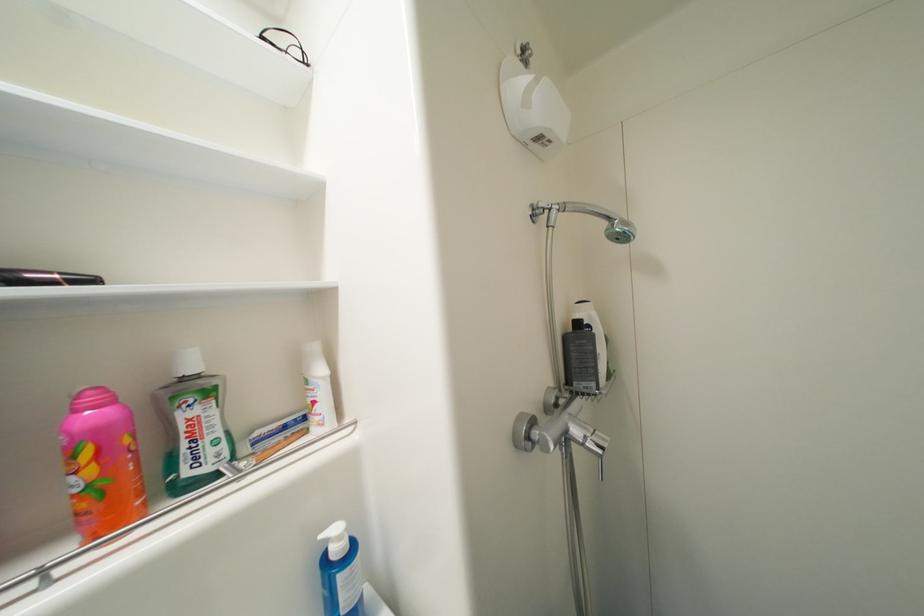
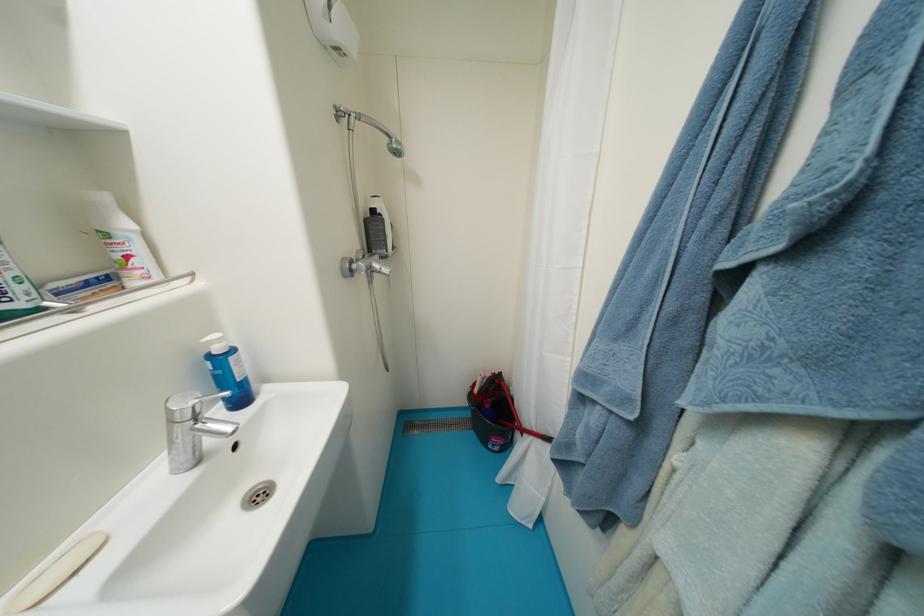
The point at (585, 326) is marked in the first image. Where is the corresponding point in the second image?

(380, 214)